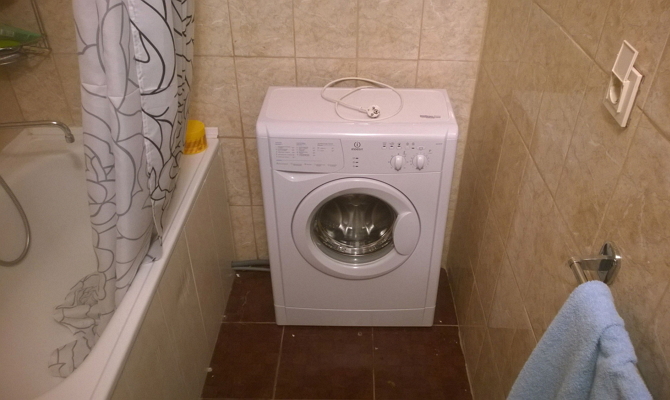
This screenshot has height=400, width=670. Identify the location of faucet. (66, 125).